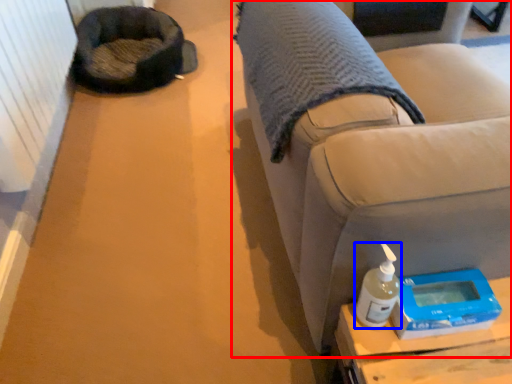
Question: Which object appears closest to the camera in this image, furniture (highlighted by a red box) or bottle (highlighted by a blue box)?

Choices:
 (A) furniture
 (B) bottle

Answer: (A)